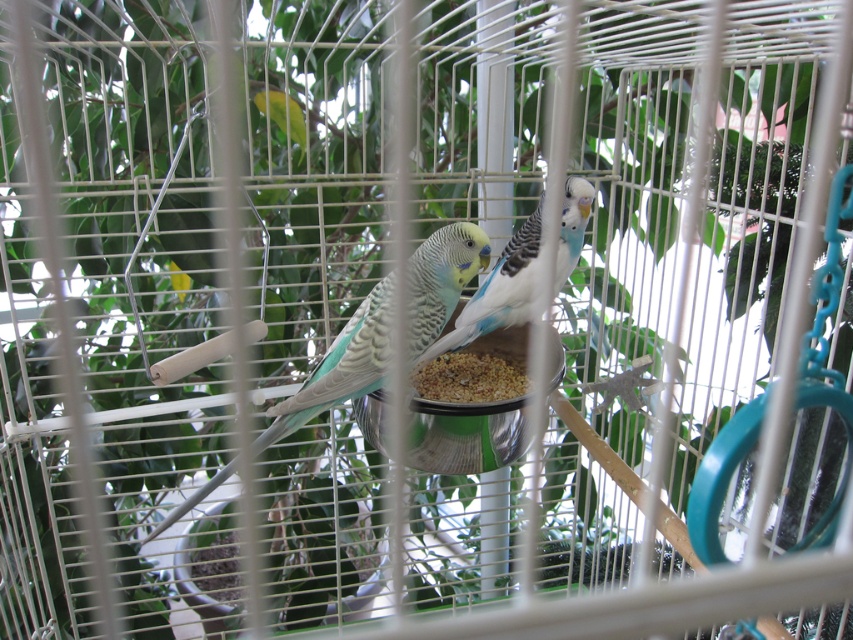
You are looking into the birdcage and see two points marked inside. Which point is closer to you, point [463,280] or point [511,237]?

Point [463,280] is closer to the viewer than point [511,237].

In the scene shown: You are a pet owner who wants to ensure the speckled teal parrot at center has enough space to move comfortably around the brown grainy food at center in its cage. Based on the image, can you determine if the parrot is wider than the food dish?

The speckled teal parrot at center is larger in width than the brown grainy food at center, so the parrot is wider than the food dish and has sufficient space to move around it.

You are a small toy that needs to land safely on the metallic silver bird feeder at center without disturbing the speckled teal parrot at center. Can you do it?

The speckled teal parrot at center is positioned over the metallic silver bird feeder at center, so you cannot land safely on the feeder without disturbing the parrot.